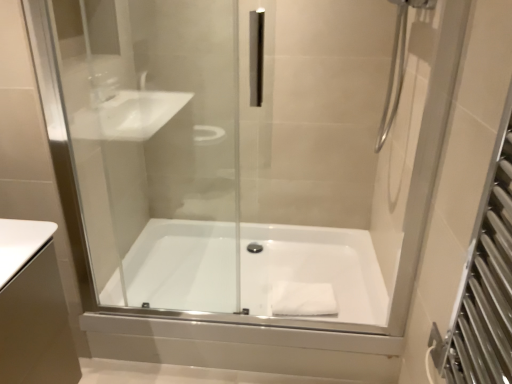
Question: Visually, is white fabric at bottom positioned to the left or to the right of white glossy bathtub at center?

Choices:
 (A) left
 (B) right

Answer: (B)

Question: Is white fabric at bottom bigger or smaller than white glossy bathtub at center?

Choices:
 (A) big
 (B) small

Answer: (B)

Question: Is white fabric at bottom wider or thinner than white glossy bathtub at center?

Choices:
 (A) wide
 (B) thin

Answer: (B)

Question: From the image's perspective, is white glossy bathtub at center above or below white fabric at bottom?

Choices:
 (A) below
 (B) above

Answer: (B)

Question: Is point pos(186,251) positioned closer to the camera than point pos(308,304)?

Choices:
 (A) farther
 (B) closer

Answer: (A)

Question: Relative to white fabric at bottom, is white glossy bathtub at center in front or behind?

Choices:
 (A) behind
 (B) front

Answer: (B)

Question: From a real-world perspective, is white glossy bathtub at center physically located above or below white fabric at bottom?

Choices:
 (A) below
 (B) above

Answer: (A)